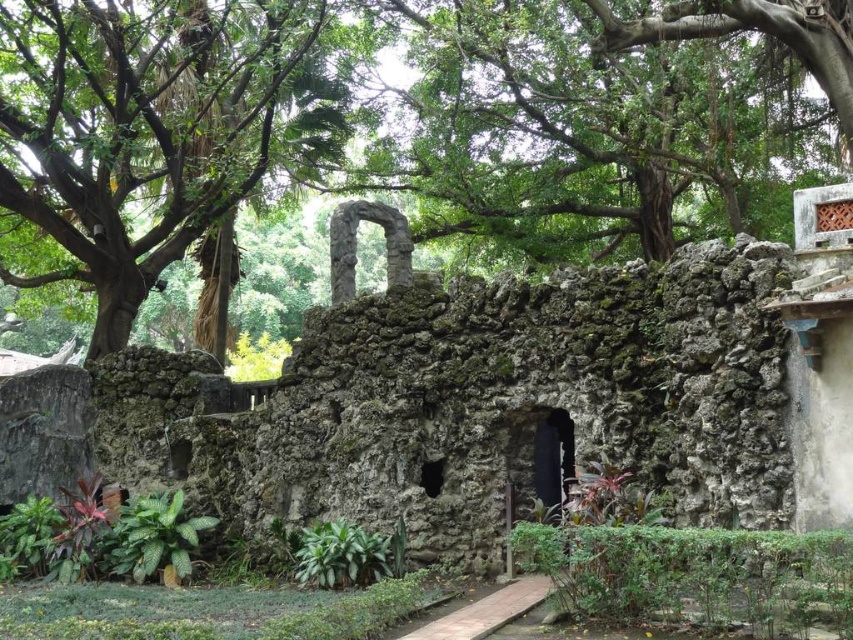
Question: Which object is the farthest from the rough stone ruins at center?

Choices:
 (A) green leafy plant at center
 (B) green leafy tree at upper center
 (C) green leafy plant at lower left

Answer: (B)

Question: Which point is farther from the camera taking this photo?

Choices:
 (A) (328, 552)
 (B) (297, 352)
 (C) (827, 96)
 (D) (115, 572)

Answer: (C)

Question: Can you confirm if rough stone ruins at center is thinner than green leafy plant at center?

Choices:
 (A) yes
 (B) no

Answer: (B)

Question: Which of the following is the farthest from the observer?

Choices:
 (A) rough stone ruins at center
 (B) green leafy plant at center
 (C) green rough bark tree at center
 (D) green leafy plant at lower left

Answer: (C)

Question: Does green rough bark tree at center have a larger size compared to green leafy tree at upper left?

Choices:
 (A) no
 (B) yes

Answer: (A)

Question: Can you confirm if rough stone ruins at center is positioned to the right of green rough bark tree at center?

Choices:
 (A) yes
 (B) no

Answer: (B)